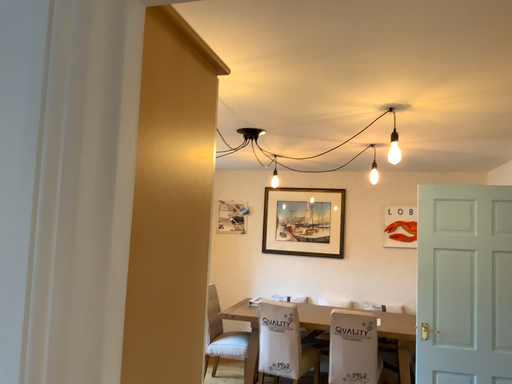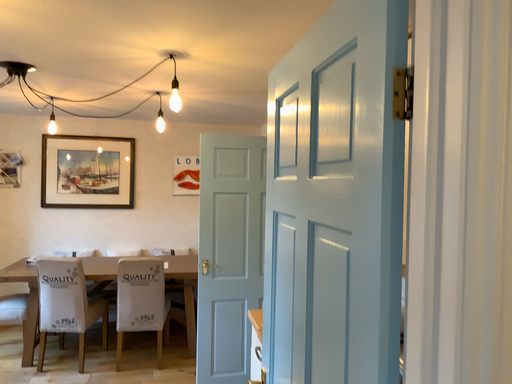
Question: How did the camera likely rotate when shooting the video?

Choices:
 (A) rotated left
 (B) rotated right

Answer: (B)